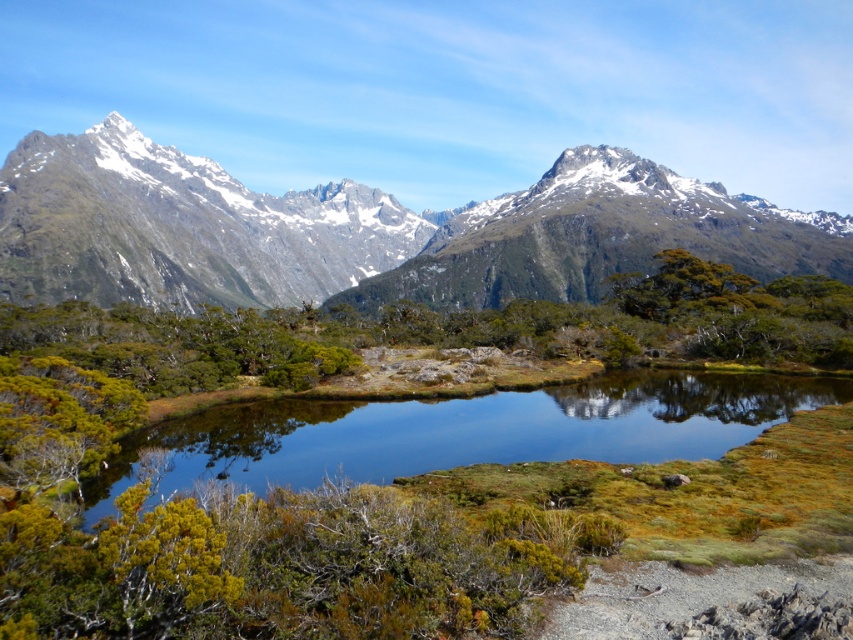
You are a hiker planning to take a photo of the snowy rock mountain range at upper center and the green grassy water at center from a position near the shrubs in the foreground. Which object will appear taller in your photo?

The snowy rock mountain range at upper center will appear taller in the photo because it has a greater height compared to the green grassy water at center.

You are standing at the viewpoint of the image and want to know how far you are from the point marked at coordinates point (613, 182). Can you determine the distance?

The distance between you and the point marked at coordinates point (613, 182) is 249.30 meters.

You are a landscape photographer planning to capture the snowy rock mountain range at upper center and the green grassy water at center in a single frame. Based on their sizes, which object will occupy more space in your photo?

The snowy rock mountain range at upper center will occupy more space in the photo since its width is larger than the green grassy water at center.